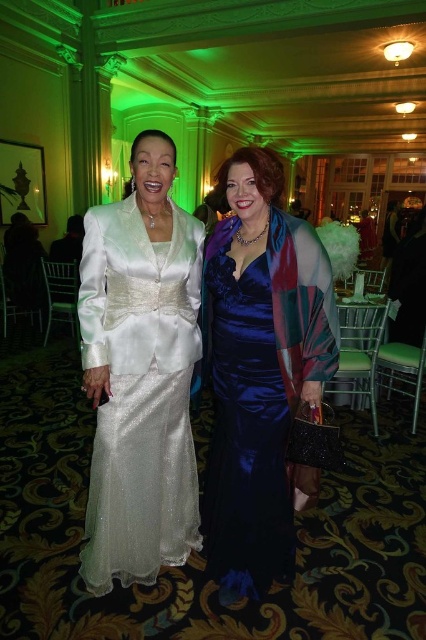
You are a photographer at the event. You need to position the two models so that their outfits are clearly visible in the photo. Given the satin white suit at center and the satin blue dress at center, which outfit should be placed closer to the camera to ensure both are fully visible?

The satin white suit at center is taller than the satin blue dress at center. To ensure both outfits are fully visible in the photo, the satin blue dress at center should be placed closer to the camera so that the taller satin white suit at center can be seen behind it without obstruction.

You are a photographer at an event and need to adjust the camera frame to fit both the satin white suit at center and the satin blue dress at center. Which of the two requires more horizontal space due to its width?

The satin white suit at center requires more horizontal space because its width surpasses that of the satin blue dress at center.